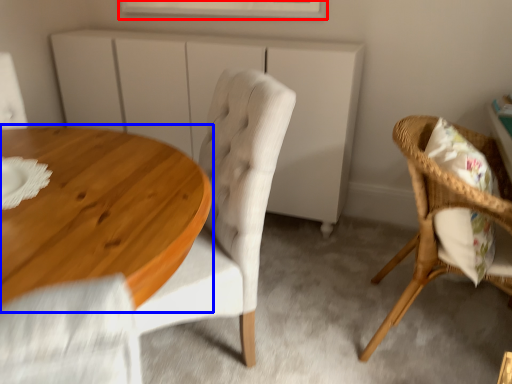
Question: Which point is further to the camera, window (highlighted by a red box) or coffee table (highlighted by a blue box)?

Choices:
 (A) window
 (B) coffee table

Answer: (A)